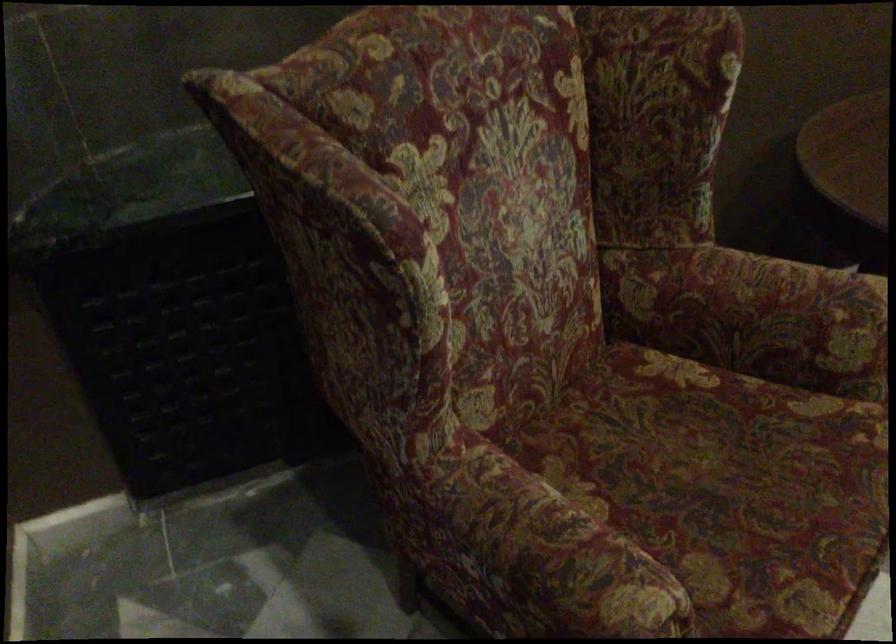
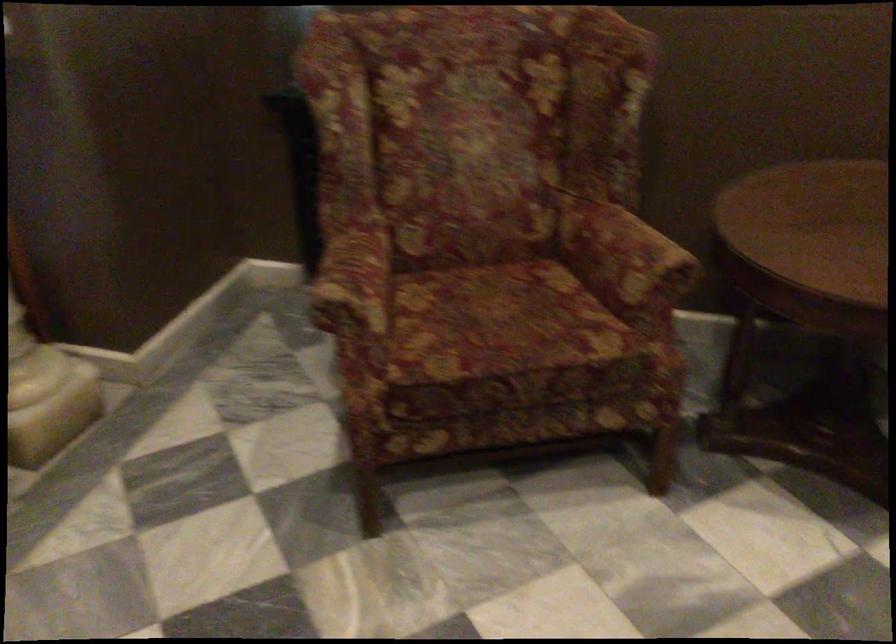
In the second image, find the point that corresponds to (805,317) in the first image.

(624, 258)